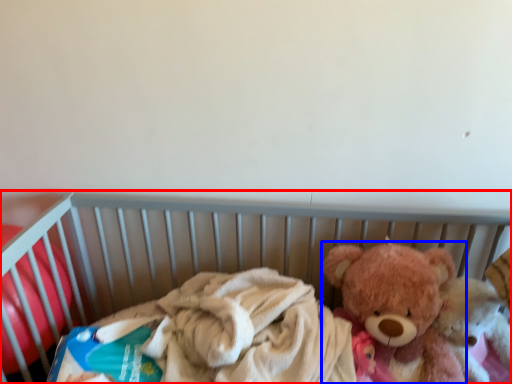
Question: Which object appears closest to the camera in this image, infant bed (highlighted by a red box) or teddy bear (highlighted by a blue box)?

Choices:
 (A) infant bed
 (B) teddy bear

Answer: (A)